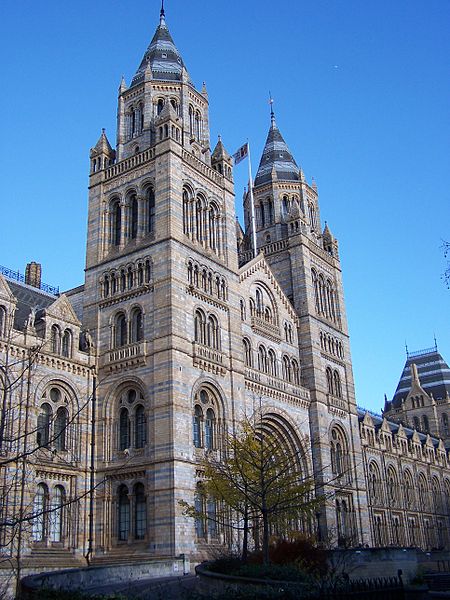
The height and width of the screenshot is (600, 450). I want to click on walk way, so click(151, 593).